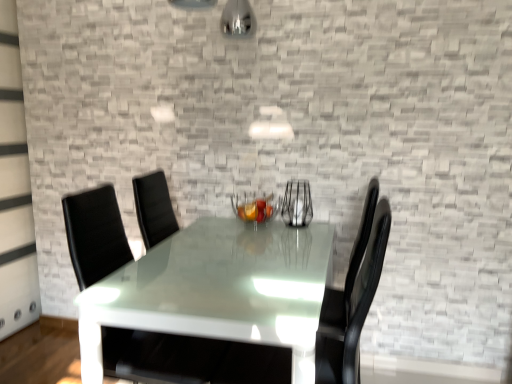
Question: Is metallic wire basket at center bigger or smaller than black leather swivel chair at center?

Choices:
 (A) big
 (B) small

Answer: (B)

Question: Considering the positions of metallic wire basket at center and black leather swivel chair at center in the image, is metallic wire basket at center taller or shorter than black leather swivel chair at center?

Choices:
 (A) short
 (B) tall

Answer: (A)

Question: Which object is positioned farthest from the glossy white table at center?

Choices:
 (A) black leather swivel chair at center
 (B) clear glass vase at center
 (C) metallic wire basket at center

Answer: (B)

Question: Which is nearer to the metallic wire basket at center?

Choices:
 (A) glossy white table at center
 (B) black leather swivel chair at center
 (C) clear glass vase at center

Answer: (C)